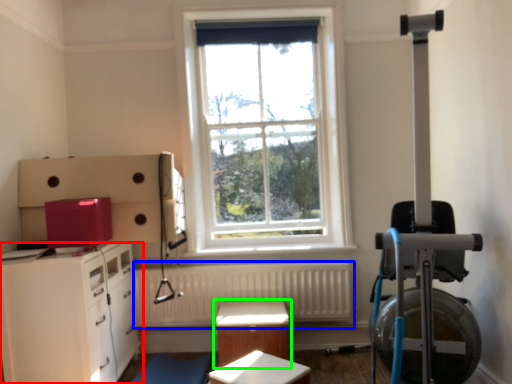
Question: Considering the real-world distances, which object is closest to chest of drawers (highlighted by a red box)? radiator (highlighted by a blue box) or table (highlighted by a green box).

Choices:
 (A) radiator
 (B) table

Answer: (A)